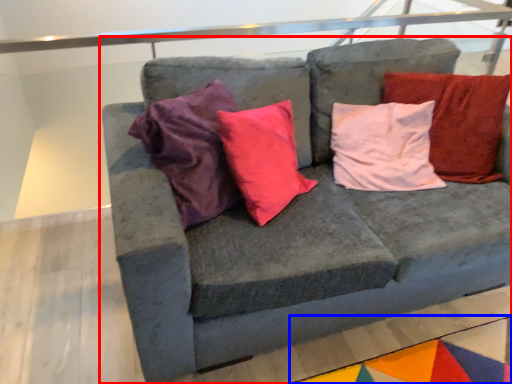
Question: Among these objects, which one is farthest to the camera, studio couch (highlighted by a red box) or mat (highlighted by a blue box)?

Choices:
 (A) studio couch
 (B) mat

Answer: (B)